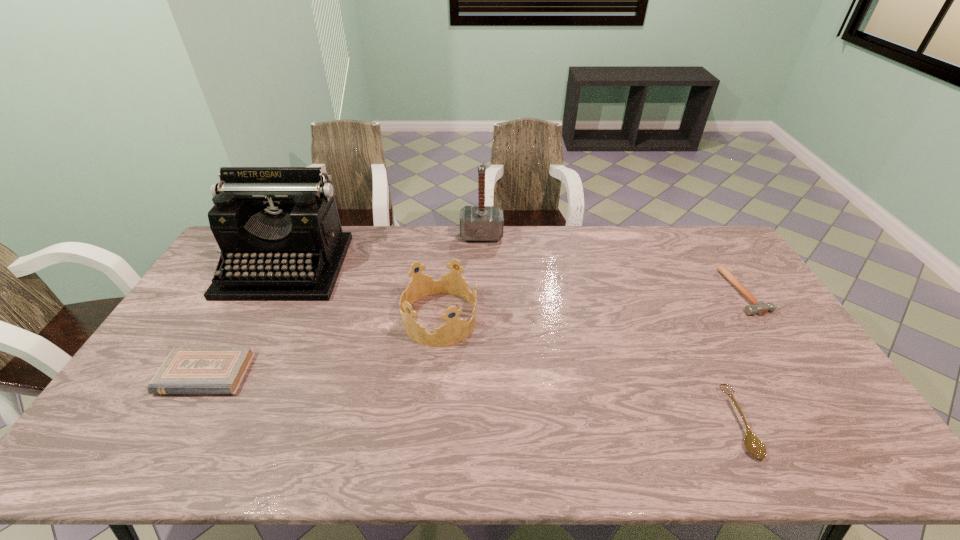
Find the location of a particular element. The image size is (960, 540). vacant area that satisfies the following two spatial constraints: 1. on the back side of the shortest object; 2. on the right side of the shorter hammer is located at coordinates (676, 292).

I want to click on free space that satisfies the following two spatial constraints: 1. on the front-facing side of the tiara; 2. on the spine side of the Bible, so 434,374.

Where is `free spot that satisfies the following two spatial constraints: 1. on the typing side of the ladle; 2. on the left side of the typewriter`? The height and width of the screenshot is (540, 960). free spot that satisfies the following two spatial constraints: 1. on the typing side of the ladle; 2. on the left side of the typewriter is located at coordinates (204, 422).